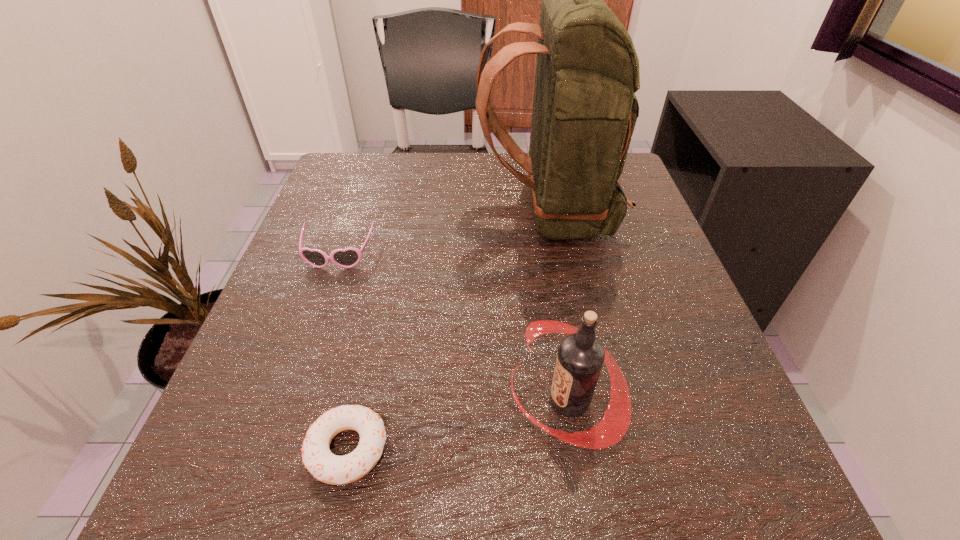
Find the location of a particular element. free region that satisfies the following two spatial constraints: 1. on the back of the backpack; 2. on the front-facing side of the sunglasses is located at coordinates (556, 255).

You are a GUI agent. You are given a task and a screenshot of the screen. Output one action in this format:
    pyautogui.click(x=<x>, y=<y>)
    Task: Click on the vacant area in the image that satisfies the following two spatial constraints: 1. on the back of the tallest object; 2. on the front-facing side of the third tallest object
    
    Given the screenshot: What is the action you would take?
    pyautogui.click(x=556, y=255)

Where is `free spot that satisfies the following two spatial constraints: 1. on the back of the backpack; 2. on the front-facing side of the second shortest object`? free spot that satisfies the following two spatial constraints: 1. on the back of the backpack; 2. on the front-facing side of the second shortest object is located at coordinates (556, 255).